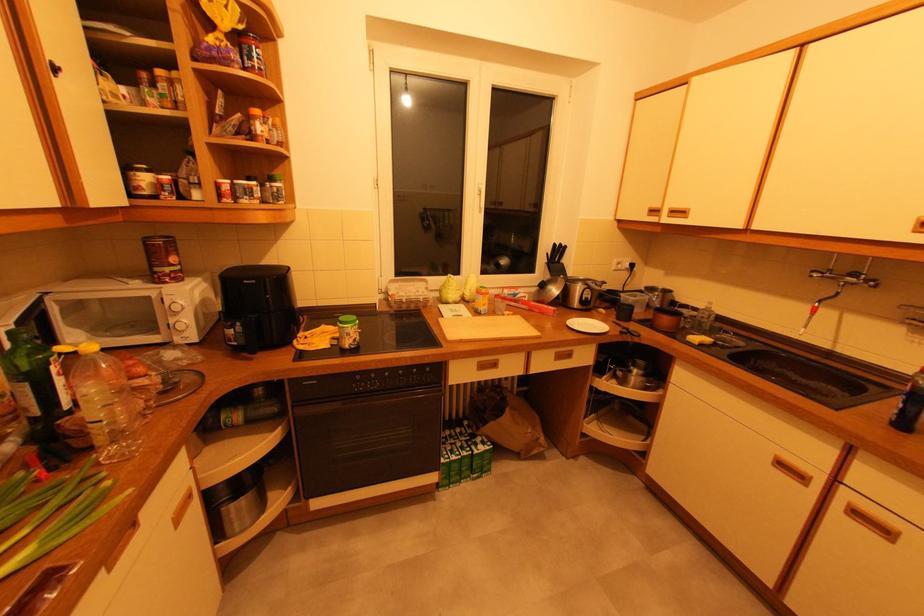
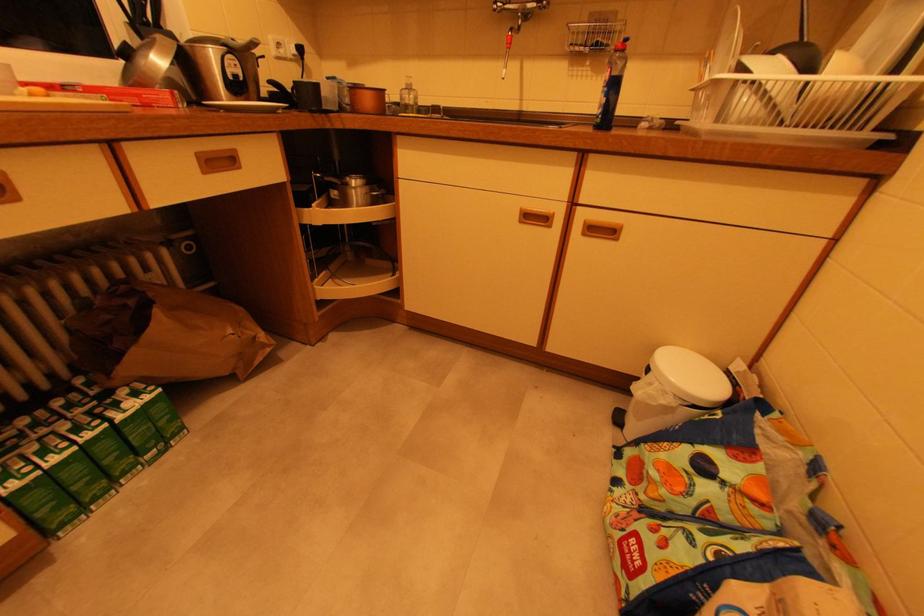
Locate, in the second image, the point that corresponds to point 541,439 in the first image.

(258, 338)